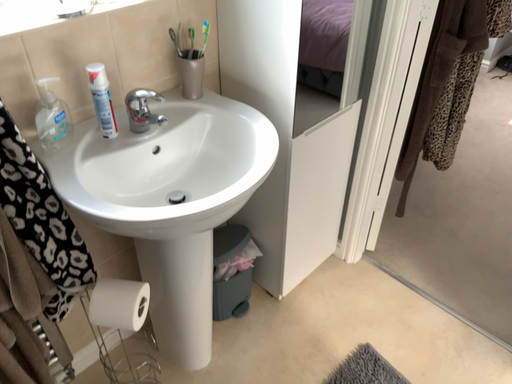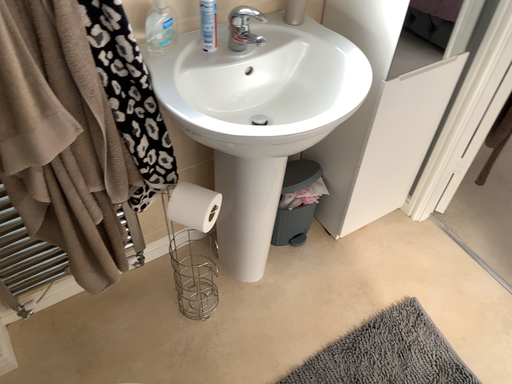
Question: Which way did the camera rotate in the video?

Choices:
 (A) rotated upward
 (B) rotated downward

Answer: (B)